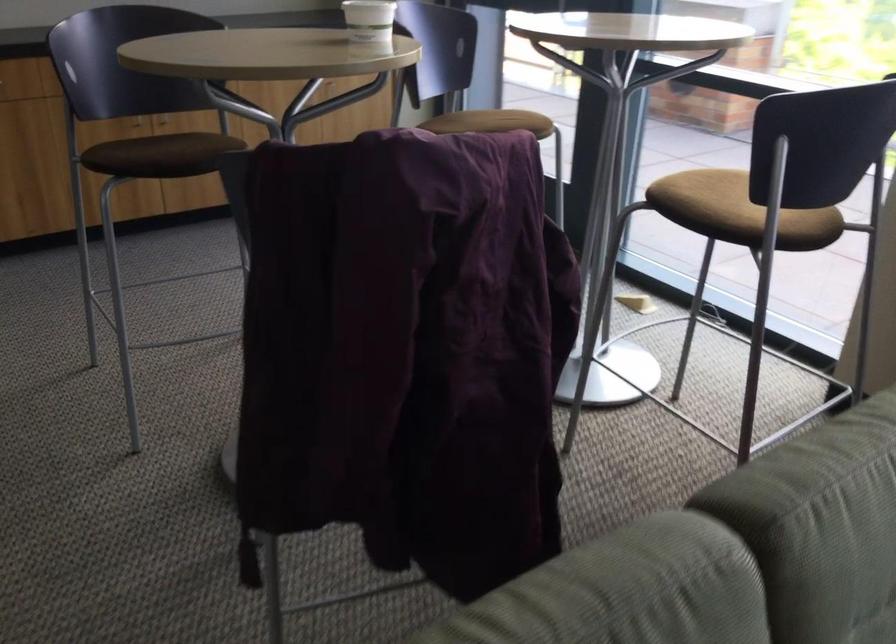
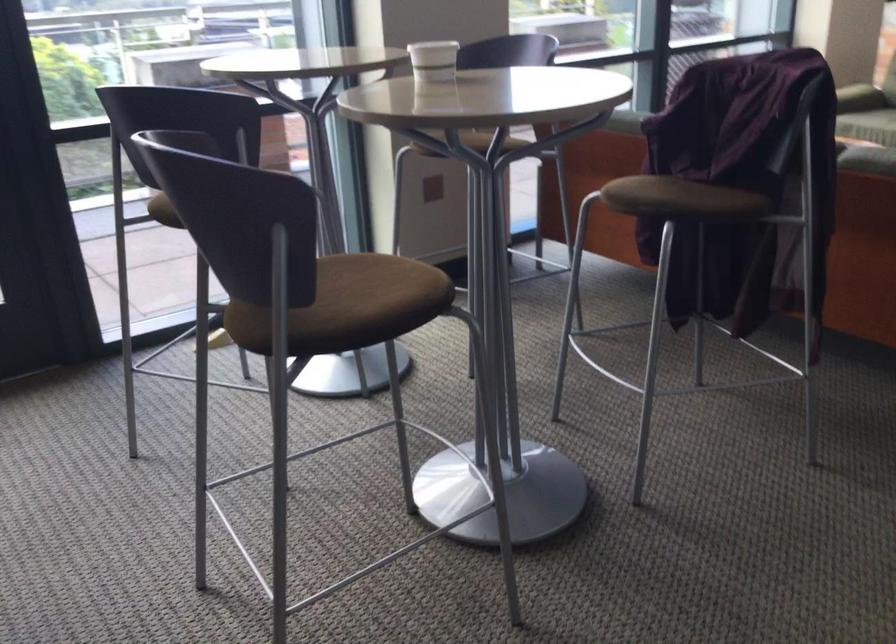
The point at (177, 147) is marked in the first image. Where is the corresponding point in the second image?

(371, 292)